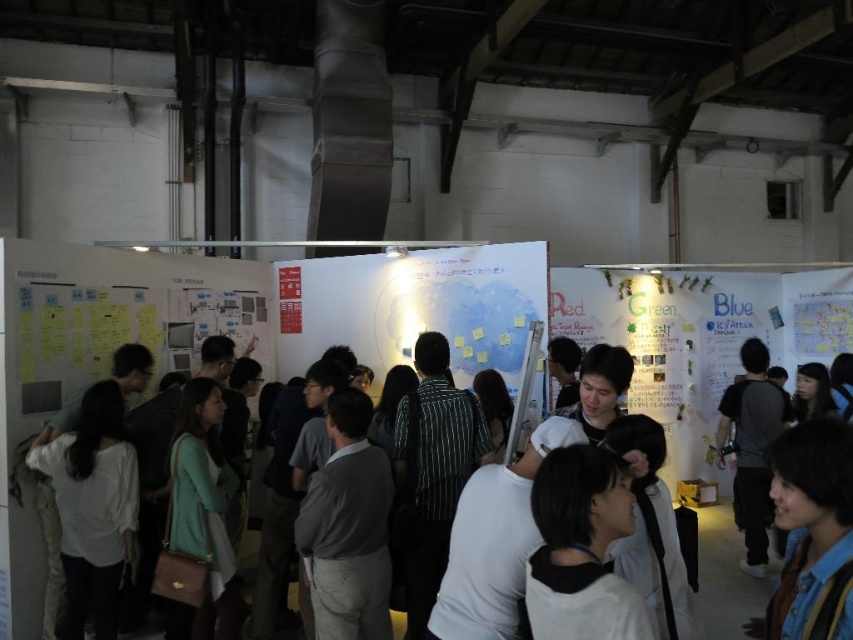
Can you confirm if green matte poster at center is thinner than white matte shirt at center?

Incorrect, green matte poster at center's width is not less than white matte shirt at center's.

Which is more to the right, green matte poster at center or white matte shirt at center?

white matte shirt at center is more to the right.

Between point (579, 317) and point (708, 589), which one is positioned behind?

The point (579, 317) is behind.

Where is `green matte poster at center`? green matte poster at center is located at coordinates (672, 342).

Is white matte poster at center wider than white matte shirt at center?

Yes.

Which is more to the right, white matte poster at center or white matte shirt at center?

From the viewer's perspective, white matte shirt at center appears more on the right side.

Is point (341, 273) more distant than point (714, 528)?

No, it is not.

Image resolution: width=853 pixels, height=640 pixels. I want to click on white matte poster at center, so click(x=415, y=307).

Looking at this image, does white matte poster at center appear over green matte poster at center?

Yes, white matte poster at center is above green matte poster at center.

Is point (427, 308) positioned before point (689, 304)?

That is True.

In order to click on white matte poster at center in this screenshot , I will do `click(415, 307)`.